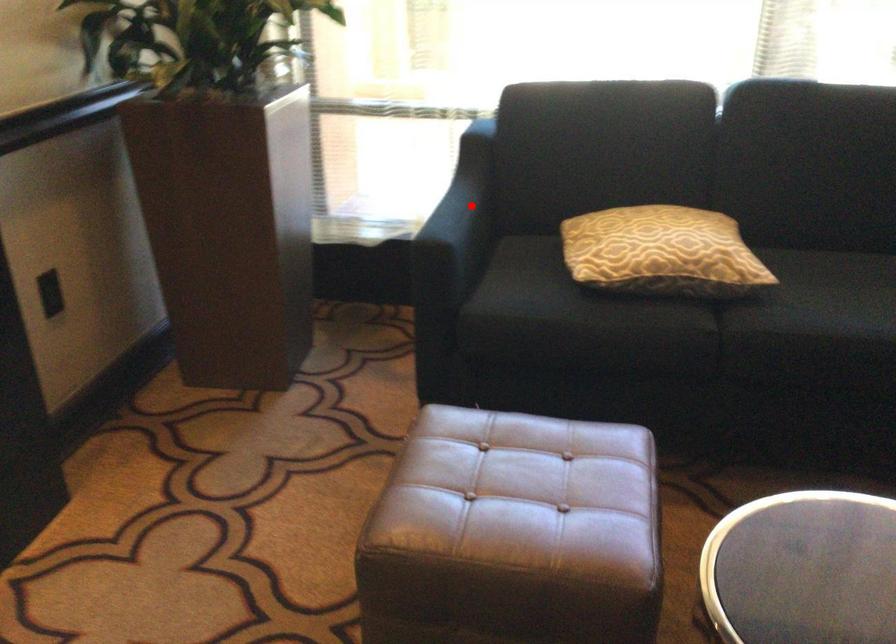
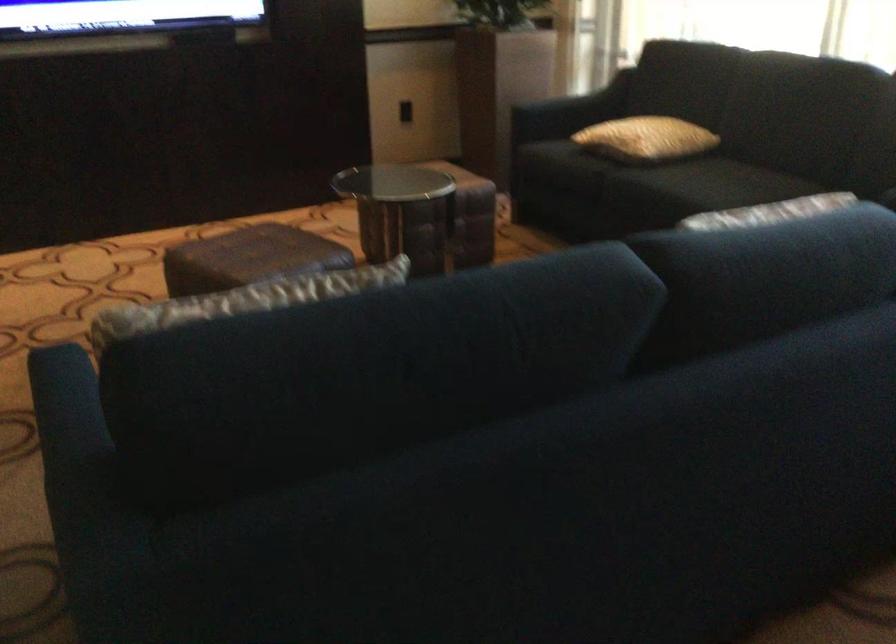
The point at the highlighted location is marked in the first image. Where is the corresponding point in the second image?

(586, 99)